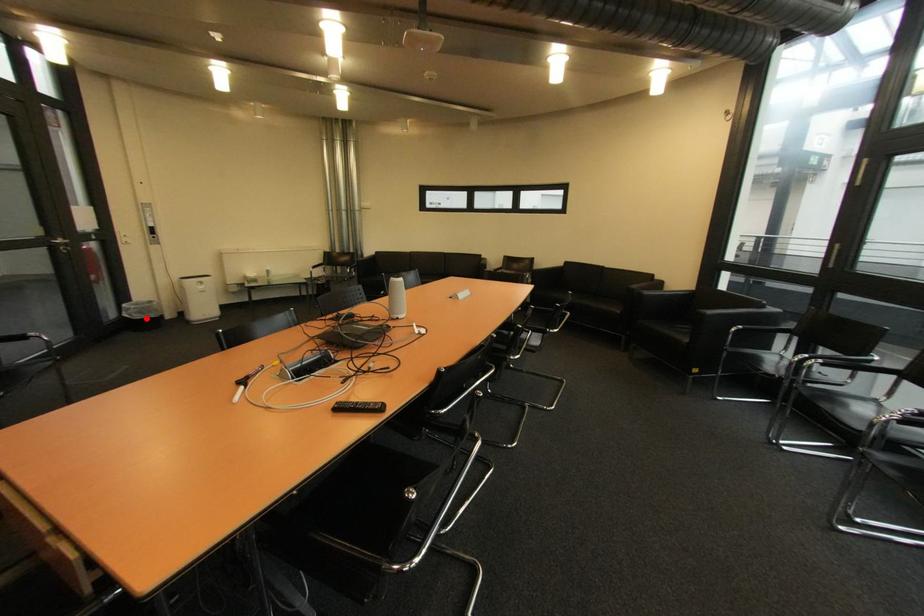
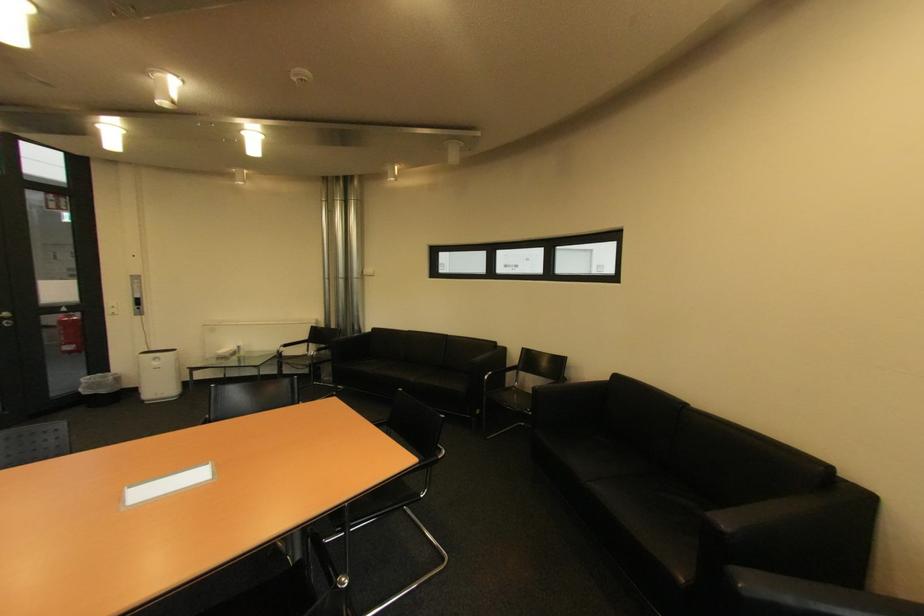
The point at the highlighted location is marked in the first image. Where is the corresponding point in the second image?

(94, 394)